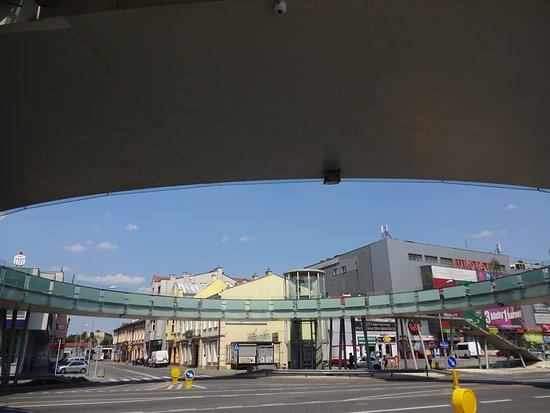
You are a GUI agent. You are given a task and a screenshot of the screen. Output one action in this format:
    pyautogui.click(x=<x>, y=<y>)
    Task: Click on the glass
    Image resolution: width=550 pixels, height=413 pixels.
    Given the screenshot: What is the action you would take?
    tap(252, 356)